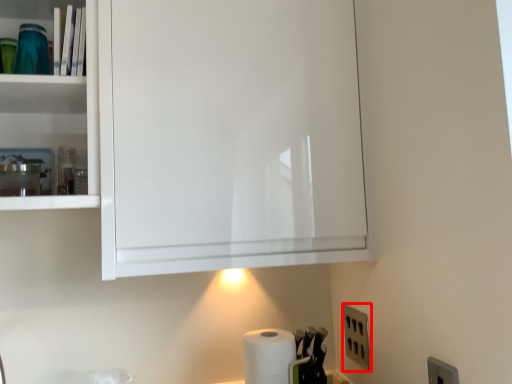
Question: Where is electric outlet (annotated by the red box) located in relation to paper towel in the image?

Choices:
 (A) left
 (B) right

Answer: (B)